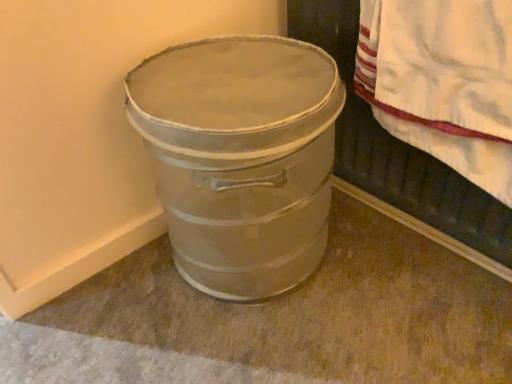
Question: Can you confirm if metallic gray bucket at lower left is shorter than metallic silver bucket at lower left?

Choices:
 (A) no
 (B) yes

Answer: (A)

Question: Is metallic gray bucket at lower left next to metallic silver bucket at lower left?

Choices:
 (A) yes
 (B) no

Answer: (B)

Question: Is metallic gray bucket at lower left further to the viewer compared to metallic silver bucket at lower left?

Choices:
 (A) yes
 (B) no

Answer: (A)

Question: Is metallic gray bucket at lower left turned away from metallic silver bucket at lower left?

Choices:
 (A) no
 (B) yes

Answer: (A)

Question: Is metallic gray bucket at lower left bigger than metallic silver bucket at lower left?

Choices:
 (A) yes
 (B) no

Answer: (A)

Question: Considering the relative sizes of metallic gray bucket at lower left and metallic silver bucket at lower left in the image provided, is metallic gray bucket at lower left wider than metallic silver bucket at lower left?

Choices:
 (A) yes
 (B) no

Answer: (B)

Question: Is metallic silver bucket at lower left at the right side of metallic gray bucket at lower left?

Choices:
 (A) yes
 (B) no

Answer: (A)

Question: Is metallic silver bucket at lower left bigger than metallic gray bucket at lower left?

Choices:
 (A) yes
 (B) no

Answer: (B)

Question: Is metallic gray bucket at lower left located within metallic silver bucket at lower left?

Choices:
 (A) no
 (B) yes

Answer: (A)

Question: Does metallic silver bucket at lower left lie in front of metallic gray bucket at lower left?

Choices:
 (A) yes
 (B) no

Answer: (A)

Question: Is metallic silver bucket at lower left positioned with its back to metallic gray bucket at lower left?

Choices:
 (A) no
 (B) yes

Answer: (B)

Question: Does metallic silver bucket at lower left have a smaller size compared to metallic gray bucket at lower left?

Choices:
 (A) yes
 (B) no

Answer: (A)

Question: Could metallic silver bucket at lower left be considered to be inside white textured towel at upper right?

Choices:
 (A) yes
 (B) no

Answer: (B)